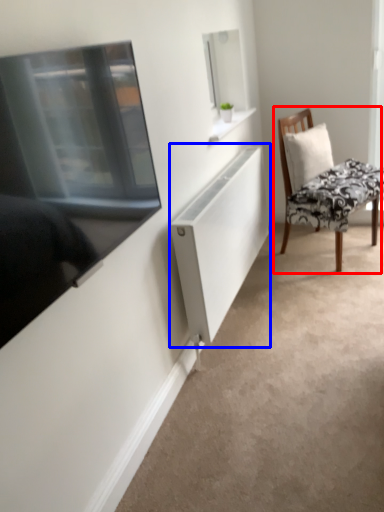
Question: Which object is further to the camera taking this photo, chair (highlighted by a red box) or cabinet (highlighted by a blue box)?

Choices:
 (A) chair
 (B) cabinet

Answer: (A)